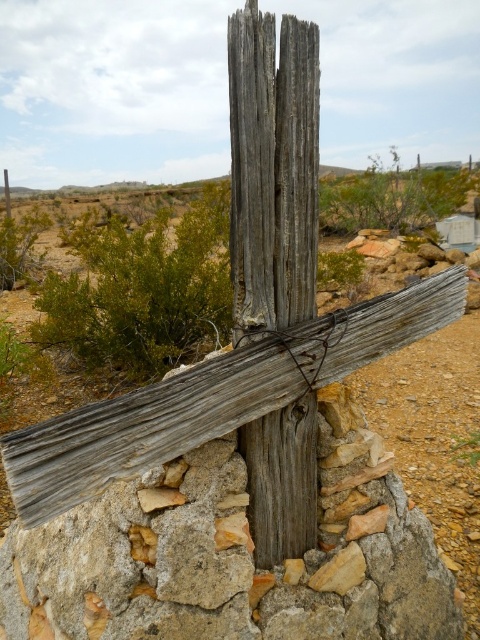
Who is lower down, weathered wood cross at center or weathered wood pole at center?

weathered wood cross at center is lower down.

Which is behind, point (95, 532) or point (299, 312)?

Point (95, 532)

Find the location of a particular element. The height and width of the screenshot is (640, 480). weathered wood cross at center is located at coordinates (232, 556).